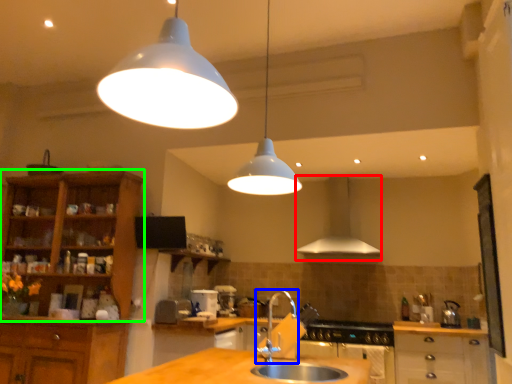
Question: Which object is the closest to the exhaust hood (highlighted by a red box)? Choose among these: tap (highlighted by a blue box) or cabinetry (highlighted by a green box).

Choices:
 (A) tap
 (B) cabinetry

Answer: (A)